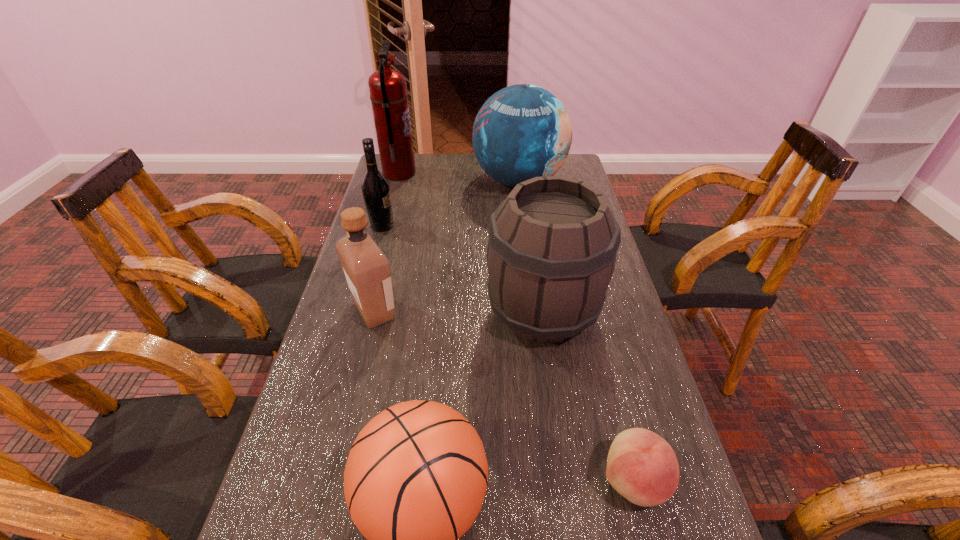
The image size is (960, 540). Identify the location of the tallest object. (388, 90).

In order to click on globe in this screenshot , I will do `click(523, 131)`.

You are a GUI agent. You are given a task and a screenshot of the screen. Output one action in this format:
    pyautogui.click(x=<x>, y=<y>)
    Task: Click on the wine bucket
    This screenshot has width=960, height=540.
    Given the screenshot: What is the action you would take?
    pyautogui.click(x=552, y=245)

Find the location of a particular element. This screenshot has width=960, height=540. liquor is located at coordinates (367, 270).

I want to click on wine bottle, so click(376, 192).

Identify the location of the shortest object. The height and width of the screenshot is (540, 960). (641, 466).

Locate an element on the screen. This screenshot has height=540, width=960. vacant space located 0.080m on the side of the tallest object with the handle and hose is located at coordinates (438, 173).

Identify the location of vacant space situated on the left of the globe. (443, 181).

What are the coordinates of `blank space located 0.330m on the left of the wine bucket` in the screenshot? It's located at (355, 312).

Identify the location of vacant space located 0.270m on the front-facing side of the liquor. The height and width of the screenshot is (540, 960). (508, 311).